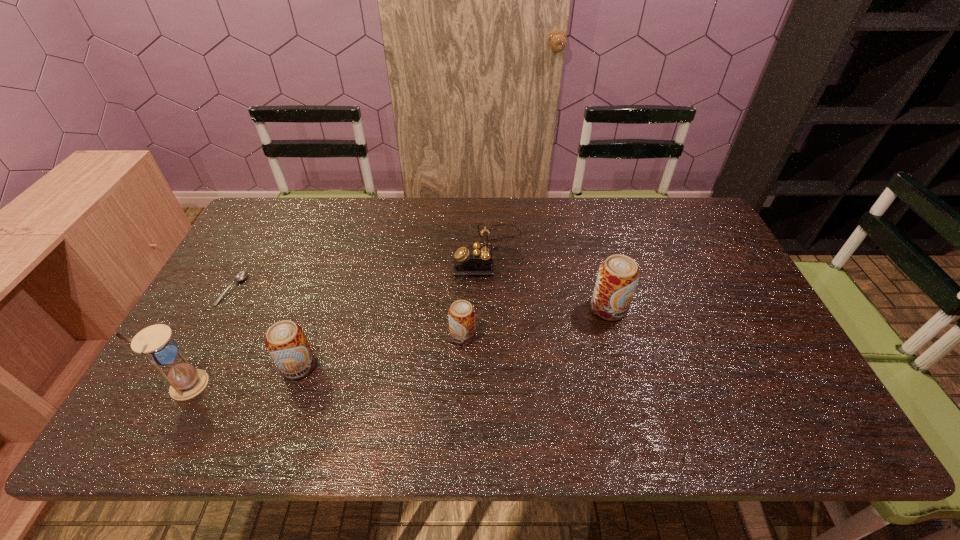
Please point a vacant point for placing a beer can on the right. Please provide its 2D coordinates. Your answer should be formatted as a tuple, i.e. [(x, y)], where the tuple contains the x and y coordinates of a point satisfying the conditions above.

[(739, 284)]